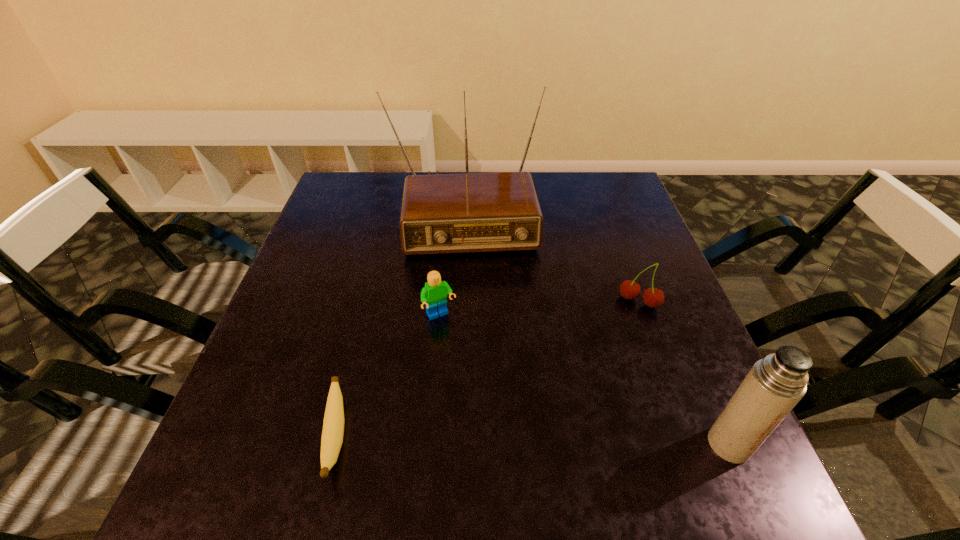
This screenshot has width=960, height=540. What are the coordinates of `free region located 0.130m on the face of the Lego` in the screenshot? It's located at (473, 370).

The width and height of the screenshot is (960, 540). Identify the location of free location located on the surface of the cherry. (621, 332).

At what (x,y) coordinates should I click in order to perform the action: click on vacant area situated 0.060m on the surface of the cherry. Please return your answer as a coordinate pair (x, y). Looking at the image, I should click on (623, 329).

Where is `vacant position located on the surface of the cherry`? The width and height of the screenshot is (960, 540). vacant position located on the surface of the cherry is located at coordinates (624, 326).

The image size is (960, 540). Find the location of `free space located on the front panel of the farthest object`. free space located on the front panel of the farthest object is located at coordinates (470, 299).

Find the location of a particular element. Image resolution: width=960 pixels, height=540 pixels. vacant space situated on the front panel of the farthest object is located at coordinates (468, 275).

Image resolution: width=960 pixels, height=540 pixels. Find the location of `vacant space located 0.360m on the front panel of the farthest object`. vacant space located 0.360m on the front panel of the farthest object is located at coordinates (476, 383).

Locate an element on the screen. This screenshot has height=540, width=960. object at the far edge is located at coordinates (474, 212).

Identify the location of banana situated at the near edge. (333, 426).

Find the location of `thermos bottle at the near edge`. thermos bottle at the near edge is located at coordinates click(x=775, y=384).